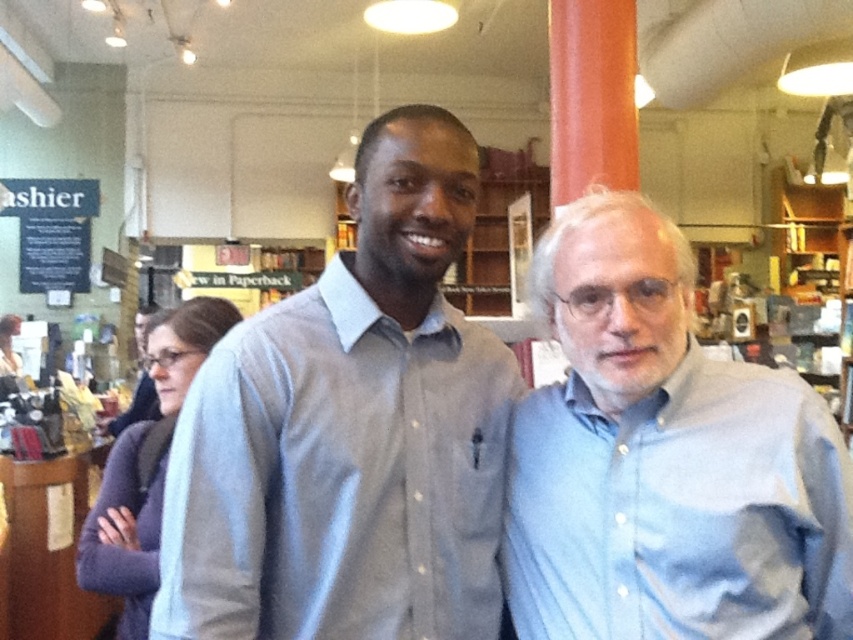
Question: Is gray button-down shirt at center to the right of light blue button-down shirt at right from the viewer's perspective?

Choices:
 (A) yes
 (B) no

Answer: (B)

Question: Which of the following is the farthest from the observer?

Choices:
 (A) tap(204, 580)
 (B) tap(647, 314)

Answer: (B)

Question: Among these objects, which one is nearest to the camera?

Choices:
 (A) purple sweater at lower left
 (B) gray button-down shirt at center

Answer: (B)

Question: Which point is closer to the camera taking this photo?

Choices:
 (A) (648, 636)
 (B) (218, 372)

Answer: (A)

Question: Is light blue button-down shirt at right further to the viewer compared to purple sweater at lower left?

Choices:
 (A) no
 (B) yes

Answer: (A)

Question: Is light blue button-down shirt at right in front of purple sweater at lower left?

Choices:
 (A) yes
 (B) no

Answer: (A)